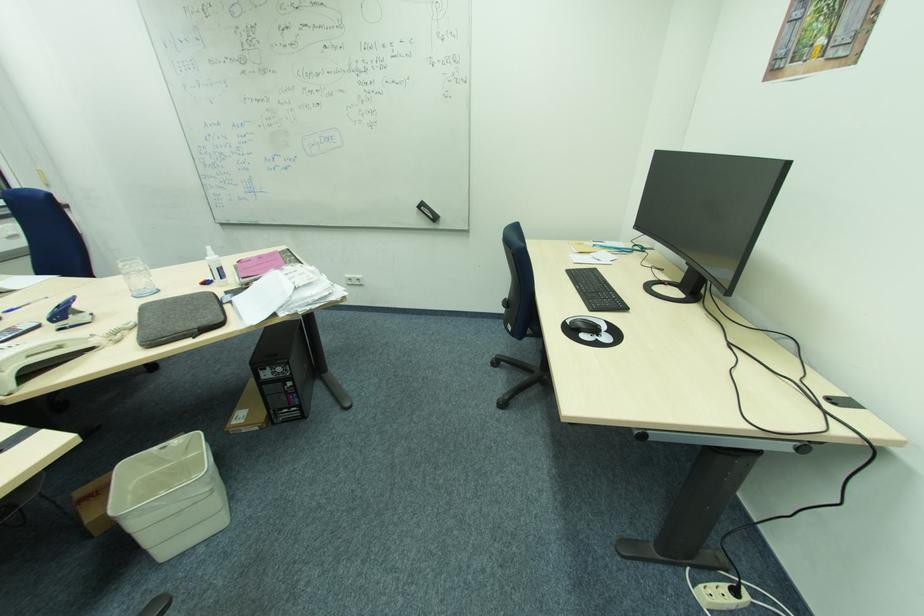
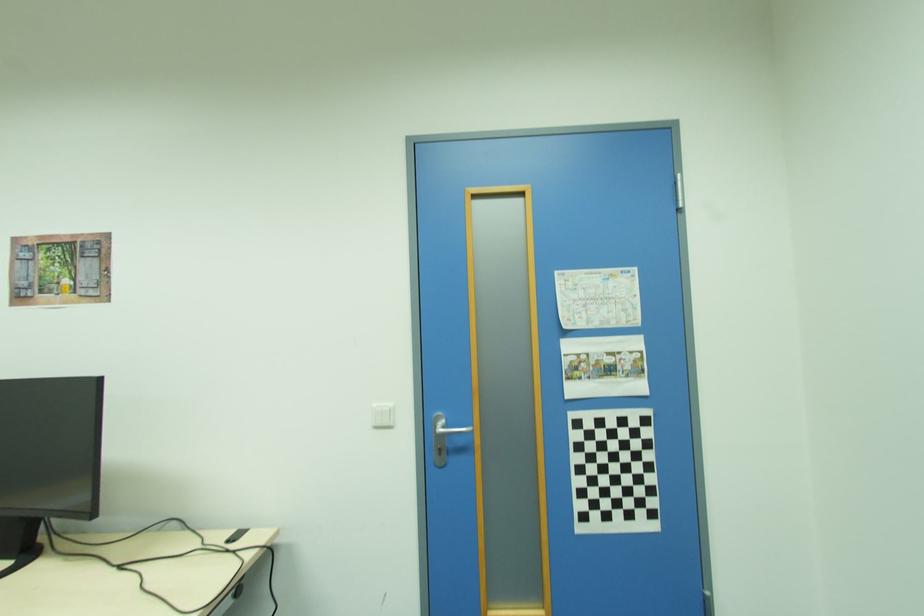
Question: How did the camera likely rotate?

Choices:
 (A) Left
 (B) Right
 (C) Up
 (D) Down

Answer: (B)